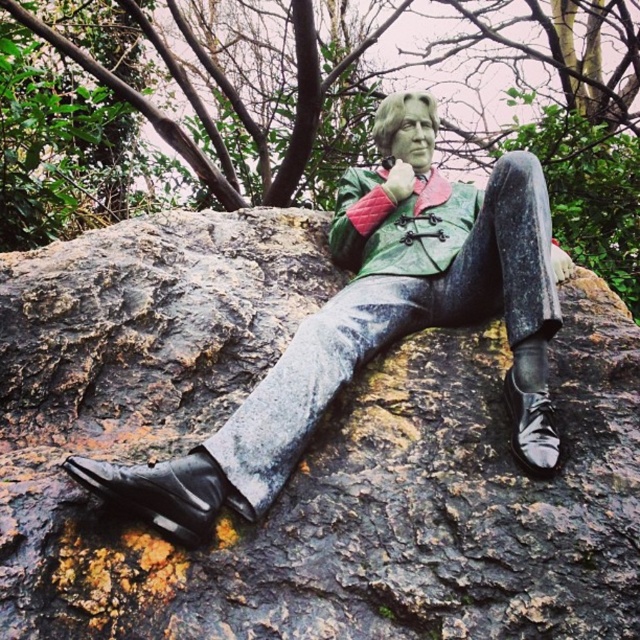
You are a maintenance worker tasked with placing a 60 cm wide barrier between the black patent leather shoe at lower left and the shiny black shoe at lower right. Is there enough space to fit the barrier between them?

The black patent leather shoe at lower left is 67.41 centimeters from the shiny black shoe at lower right. Since the barrier is 60 cm wide, there is sufficient space to place it between them as the distance is greater than the barrier width.

You are an art restorer examining the statue. You notice the shiny black shoes at lower left and shiny black shoe at lower right. Which one has a bigger size?

The shiny black shoes at lower left has a larger size compared to the shiny black shoe at lower right.